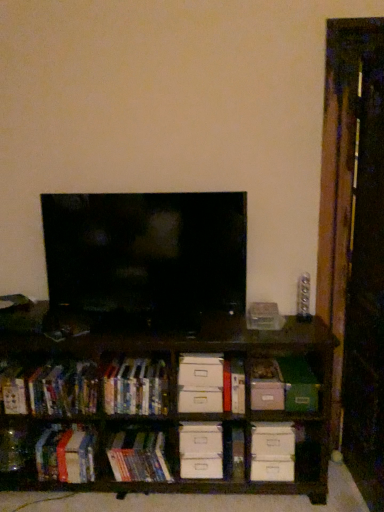
Identify the location of vacant area on top of green matte paper at center-right (from a real-world perspective). (296, 370).